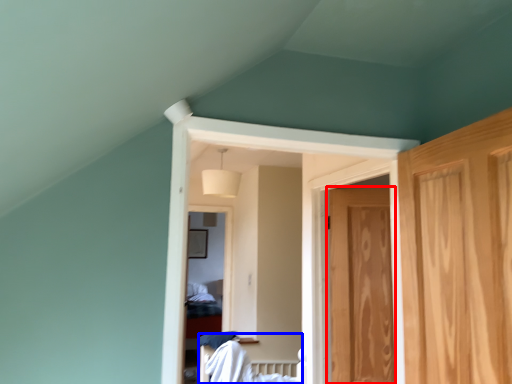
Question: Which object appears farthest to the camera in this image, door (highlighted by a red box) or bed (highlighted by a blue box)?

Choices:
 (A) door
 (B) bed

Answer: (A)